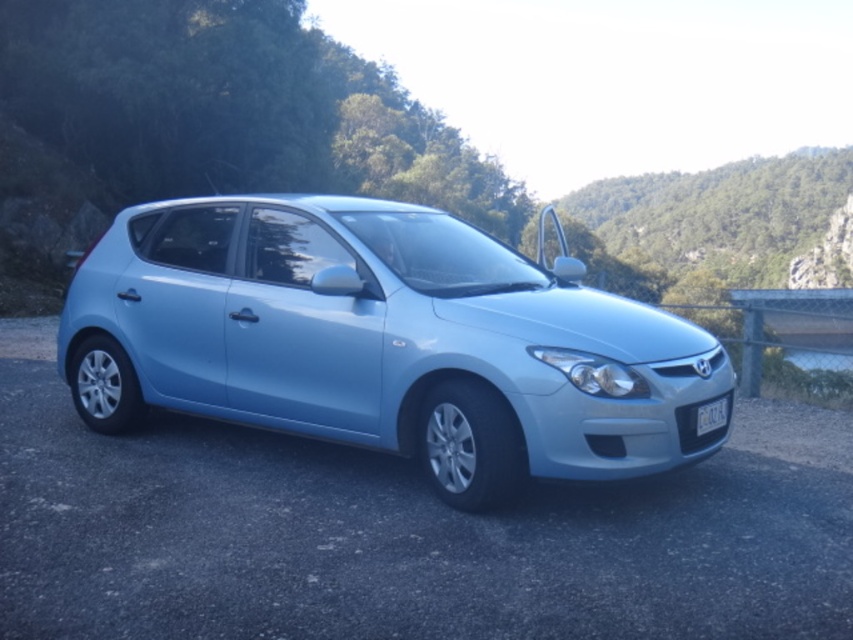
Question: Can you confirm if satin light blue car at center is positioned below white plastic license plate at center?

Choices:
 (A) no
 (B) yes

Answer: (A)

Question: Does satin light blue car at center appear over white plastic license plate at center?

Choices:
 (A) no
 (B) yes

Answer: (B)

Question: Is satin light blue car at center wider than white plastic license plate at center?

Choices:
 (A) no
 (B) yes

Answer: (B)

Question: Among these points, which one is nearest to the camera?

Choices:
 (A) (613, 340)
 (B) (703, 419)

Answer: (A)

Question: Which object is farther from the camera taking this photo?

Choices:
 (A) satin light blue car at center
 (B) white plastic license plate at center

Answer: (B)